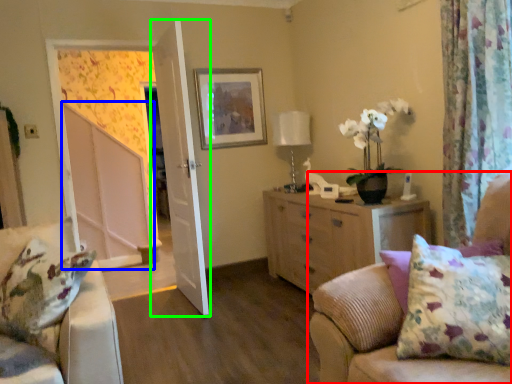
Question: Based on their relative distances, which object is nearer to studio couch (highlighted by a red box)? Choose from screen door (highlighted by a blue box) and door (highlighted by a green box).

Choices:
 (A) screen door
 (B) door

Answer: (B)